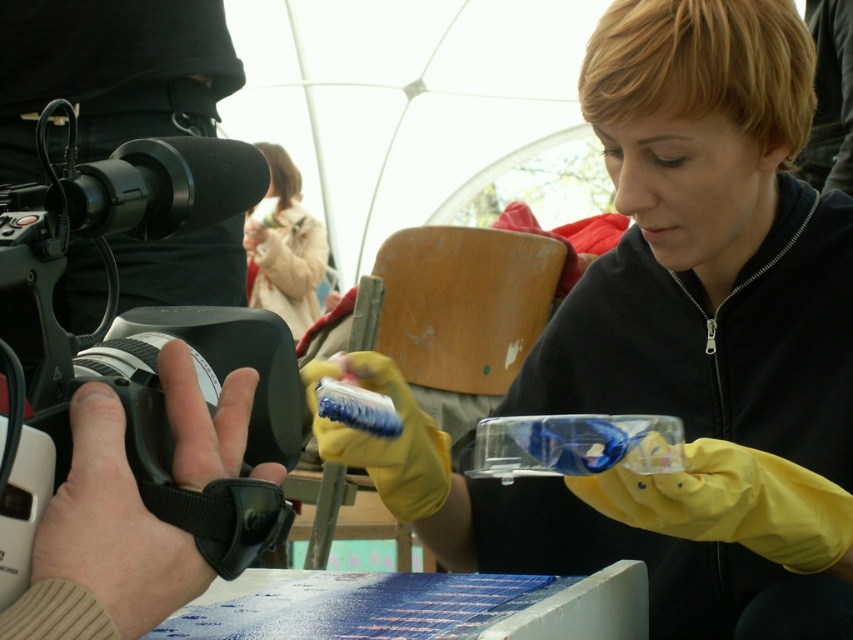
Question: Which point is closer to the camera taking this photo?

Choices:
 (A) (616, 154)
 (B) (144, 388)

Answer: (B)

Question: Which point is farther to the camera?

Choices:
 (A) (0, 528)
 (B) (253, 289)
 (C) (757, 465)

Answer: (B)

Question: Is yellow rubber gloves at center positioned before black plastic video camera at left?

Choices:
 (A) no
 (B) yes

Answer: (A)

Question: Considering the relative positions of black plastic video camera at left and fuzzy beige coat at upper left in the image provided, where is black plastic video camera at left located with respect to fuzzy beige coat at upper left?

Choices:
 (A) above
 (B) below

Answer: (B)

Question: Can you confirm if black plastic video camera at left is positioned to the right of fuzzy beige coat at upper left?

Choices:
 (A) no
 (B) yes

Answer: (B)

Question: Which is nearer to the fuzzy beige coat at upper left?

Choices:
 (A) yellow rubber gloves at center
 (B) black plastic video camera at left

Answer: (A)